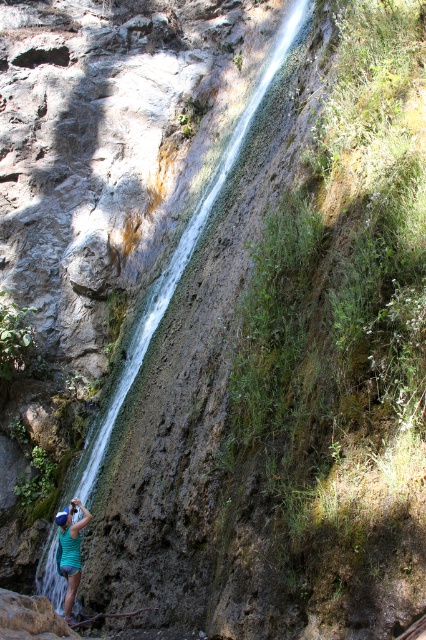
You are a hiker who wants to cross the clear water at center to reach the other side. However, you have a friend wearing the green fabric shirt at lower left who is shorter than you. Can both of you safely cross the water without getting into trouble?

The clear water at center is much taller than the green fabric shirt at lower left. Since the water is taller than your friend, there is a risk that they might get swept away or struggle to cross safely. It is advisable to find another route or wait for assistance to ensure both of you can cross safely.

You are a hiker who wants to cross the area near the base of the waterfall. You see the clear water at center and the green fabric shirt at lower left. Which object is located above the other?

The clear water at center is positioned over the green fabric shirt at lower left, so the clear water at center is above the green fabric shirt at lower left.

Looking at this image, you are standing at the base of the waterfall and want to reach the point marked by the coordinates. Which coordinate point, point (281, 28) or point (71, 570), is closer to you?

Point (281, 28) is closer to you because it is further to the viewer than point (71, 570).